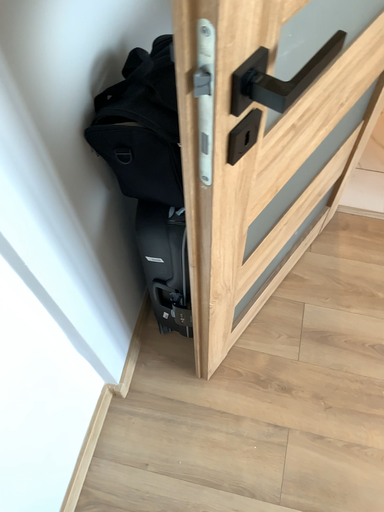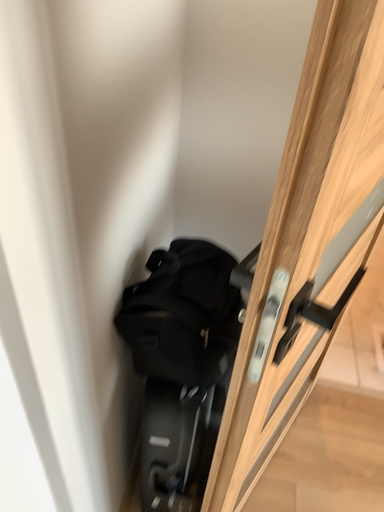
Question: How did the camera likely rotate when shooting the video?

Choices:
 (A) rotated upward
 (B) rotated downward

Answer: (A)